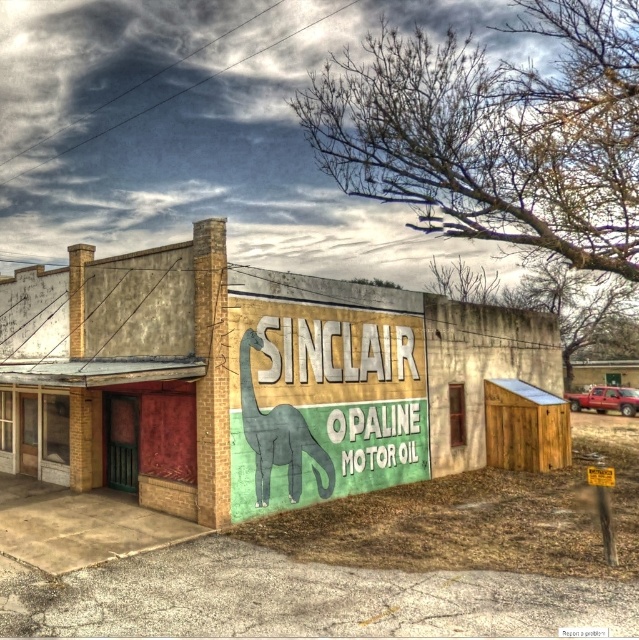
Question: Which point is closer to the camera?

Choices:
 (A) (309, 385)
 (B) (273, 435)

Answer: (B)

Question: Does green matte sign at center have a larger size compared to gray matte dinosaur at center?

Choices:
 (A) yes
 (B) no

Answer: (B)

Question: Among these points, which one is farthest from the camera?

Choices:
 (A) (254, 408)
 (B) (378, 480)

Answer: (B)

Question: Observing the image, what is the correct spatial positioning of green matte sign at center in reference to gray matte dinosaur at center?

Choices:
 (A) below
 (B) above

Answer: (B)

Question: Observing the image, what is the correct spatial positioning of green matte sign at center in reference to gray matte dinosaur at center?

Choices:
 (A) left
 (B) right

Answer: (A)